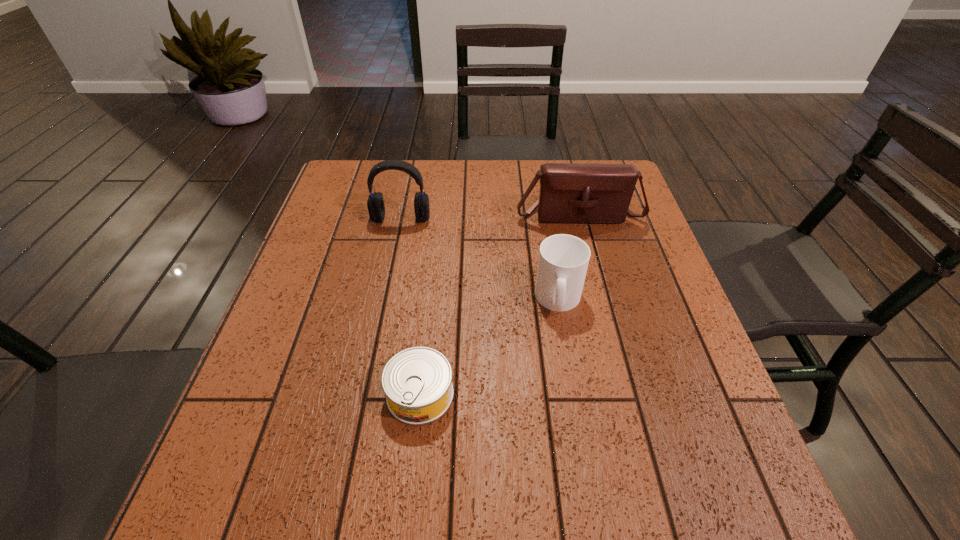
What are the coordinates of `object that is positioned at the far edge` in the screenshot? It's located at (569, 193).

Where is `object that is at the left edge`? object that is at the left edge is located at coordinates (375, 203).

Where is `object located at the right edge`? object located at the right edge is located at coordinates (569, 193).

At what (x,y) coordinates should I click in order to perform the action: click on object present at the far right corner. Please return your answer as a coordinate pair (x, y). This screenshot has height=540, width=960. Looking at the image, I should click on (569, 193).

At what (x,y) coordinates should I click in order to perform the action: click on vacant space at the far edge of the desktop. Please return your answer as a coordinate pair (x, y). This screenshot has height=540, width=960. Looking at the image, I should click on (442, 184).

Where is `free region at the left edge of the desktop`? The image size is (960, 540). free region at the left edge of the desktop is located at coordinates (357, 234).

Identify the location of free space at the right edge of the desktop. (593, 237).

Locate an element on the screen. vacant space at the far left corner is located at coordinates (332, 194).

Find the location of `vacant area at the near right corner of the desktop`. vacant area at the near right corner of the desktop is located at coordinates click(703, 512).

The width and height of the screenshot is (960, 540). I want to click on vacant area that lies between the nearest object and the headset, so click(x=411, y=306).